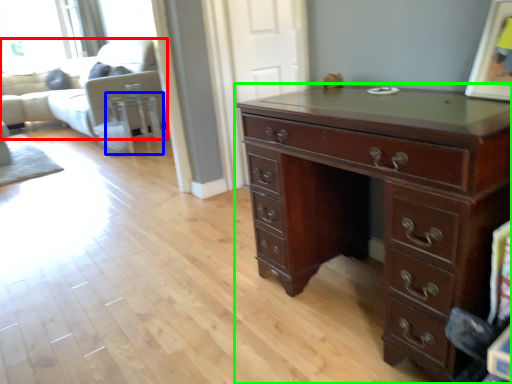
Question: Estimate the real-world distances between objects in this image. Which object is closer to couch (highlighted by a red box), side table (highlighted by a blue box) or chest of drawers (highlighted by a green box)?

Choices:
 (A) side table
 (B) chest of drawers

Answer: (A)